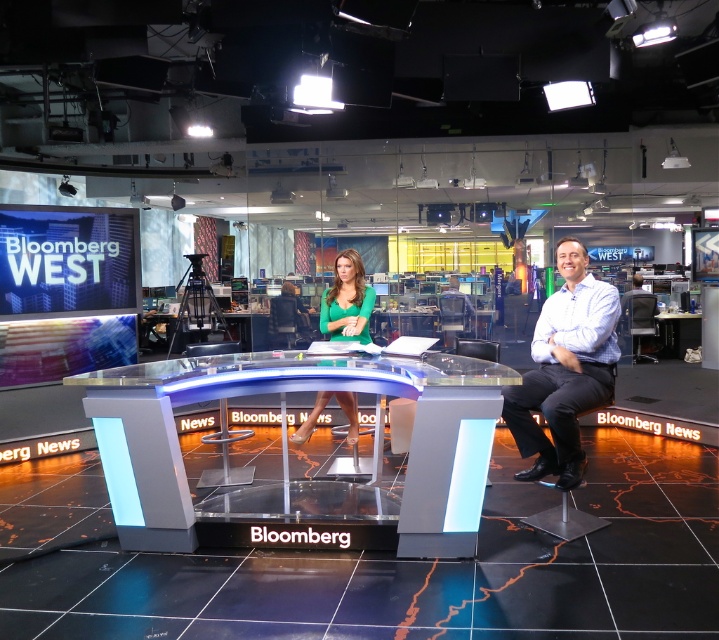
You are a camera operator in the Bloomberg studio. You need to focus on the green matte dress at center and the gray fabric chair at right. Which object is closer to the camera?

The green matte dress at center is closer to the viewer than the gray fabric chair at right, so the camera should focus on the green matte dress at center first as it is nearer.